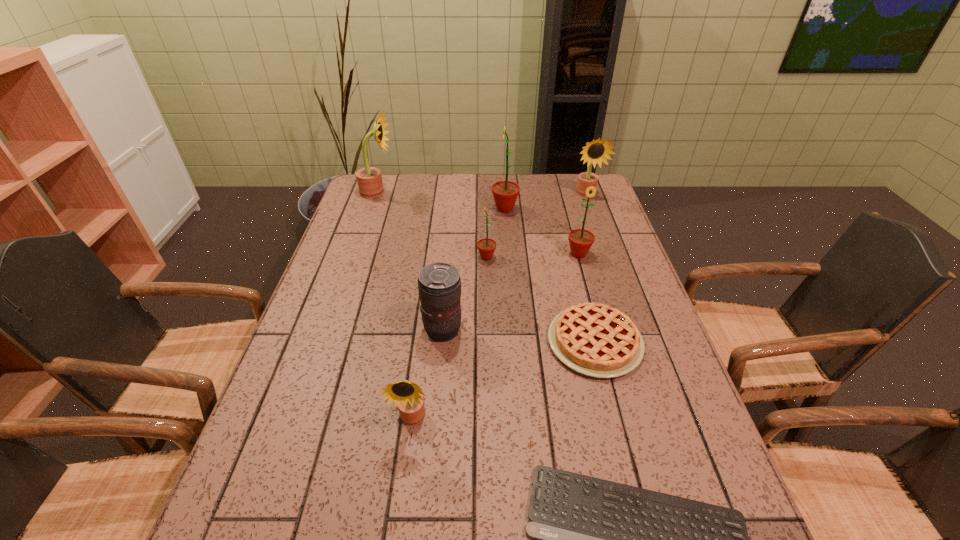
Locate an element on the screen. This screenshot has width=960, height=540. the fifth closest sunflower to the leftmost object is located at coordinates (x=407, y=395).

At what (x,y) coordinates should I click in order to perform the action: click on sunflower that is the third closest to the second yellow sunflower from right to left. Please return your answer as a coordinate pair (x, y). This screenshot has height=540, width=960. Looking at the image, I should click on (505, 193).

Locate an element on the screen. This screenshot has height=540, width=960. the closest yellow sunflower relative to the smallest yellow sunflower is located at coordinates (369, 179).

Locate which yellow sunflower is the second closest to the tan pie. Please provide its 2D coordinates. Your answer should be formatted as a tuple, i.e. [(x, y)], where the tuple contains the x and y coordinates of a point satisfying the conditions above.

[(597, 151)]

Select which green sunflower is the second closest to the leftmost yellow sunflower. Please provide its 2D coordinates. Your answer should be formatted as a tuple, i.e. [(x, y)], where the tuple contains the x and y coordinates of a point satisfying the conditions above.

[(486, 246)]

Locate an element on the screen. The width and height of the screenshot is (960, 540). green sunflower that is the second closest to the gray computer keyboard is located at coordinates (580, 240).

You are a GUI agent. You are given a task and a screenshot of the screen. Output one action in this format:
    pyautogui.click(x=<x>, y=<y>)
    Task: Click on the vacant space that satisfies the following two spatial constraints: 1. on the face of the rightmost green sunflower; 2. on the side of the telephoto lens where the control switches are located
    Image resolution: width=960 pixels, height=540 pixels.
    Given the screenshot: What is the action you would take?
    pyautogui.click(x=599, y=330)

Identify the location of free space that satisfies the following two spatial constraints: 1. on the face of the farthest green sunflower; 2. on the right side of the pie. (516, 342).

Find the location of `free region that satisfies the following two spatial constraints: 1. on the face of the smallest green sunflower; 2. on the face of the second nearest object`. free region that satisfies the following two spatial constraints: 1. on the face of the smallest green sunflower; 2. on the face of the second nearest object is located at coordinates (490, 420).

Where is `vacant area that satisfies the following two spatial constraints: 1. on the face of the smallest green sunflower; 2. on the face of the second yellow sunflower from right to left`? vacant area that satisfies the following two spatial constraints: 1. on the face of the smallest green sunflower; 2. on the face of the second yellow sunflower from right to left is located at coordinates (490, 420).